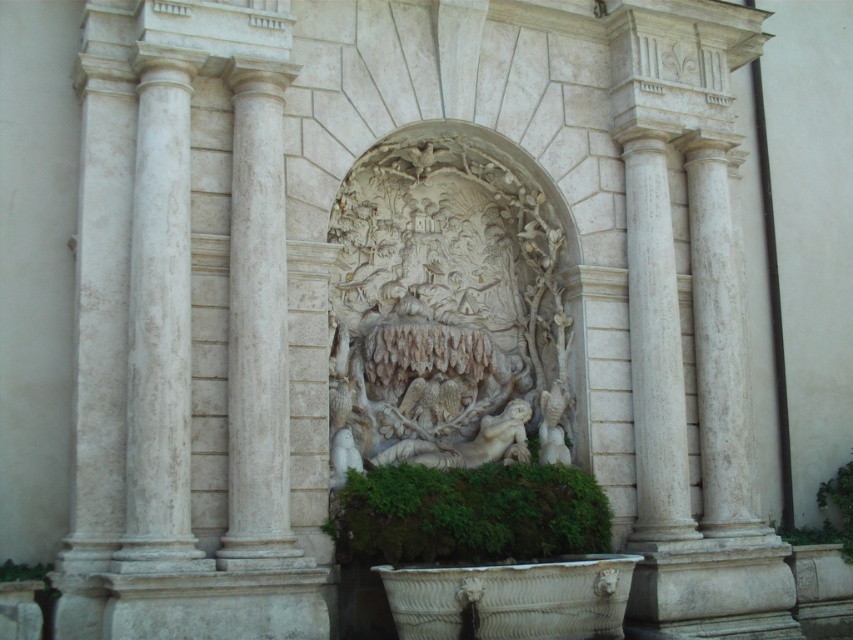
Can you confirm if white marble column at center is positioned above white marble column at right?

Yes, white marble column at center is above white marble column at right.

Locate an element on the screen. This screenshot has height=640, width=853. white marble column at center is located at coordinates (257, 326).

Which is in front, point (253, 499) or point (659, 534)?

Positioned in front is point (253, 499).

Identify the location of white marble column at center. (257, 326).

Does white stone carving at center have a greater width compared to white marble column at center?

Yes, white stone carving at center is wider than white marble column at center.

Who is positioned more to the left, white stone carving at center or white marble column at center?

From the viewer's perspective, white marble column at center appears more on the left side.

Who is more distant from viewer, (403, 241) or (263, 189)?

Positioned behind is point (403, 241).

Find the location of a particular element. white stone carving at center is located at coordinates (444, 308).

Does white stone carving at center appear on the right side of white marble column at left?

Yes, white stone carving at center is to the right of white marble column at left.

Is the position of white stone carving at center less distant than that of white marble column at left?

No, white stone carving at center is behind white marble column at left.

Does point (389, 404) come farther from viewer compared to point (189, 465)?

Yes, it is behind point (189, 465).

The image size is (853, 640). Identify the location of white stone carving at center. (444, 308).